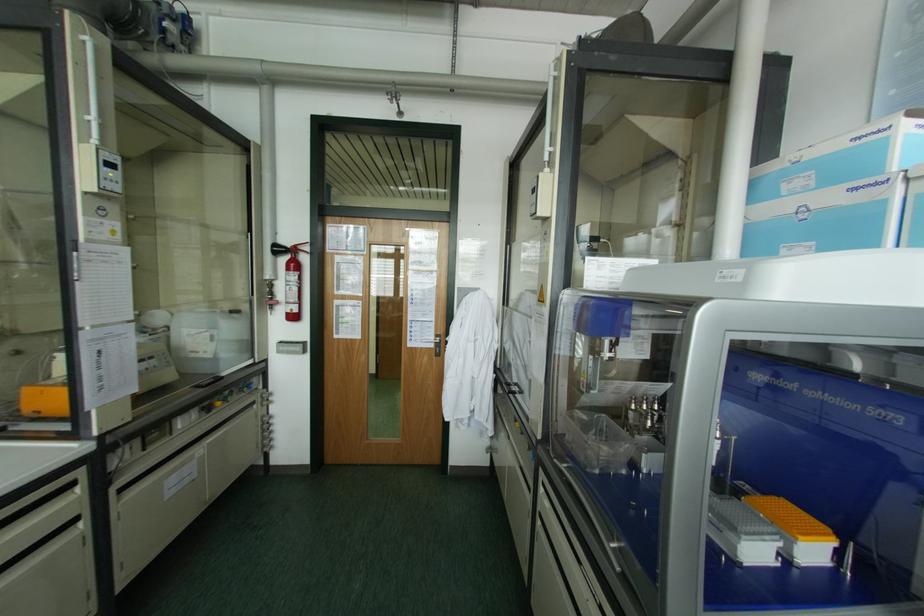
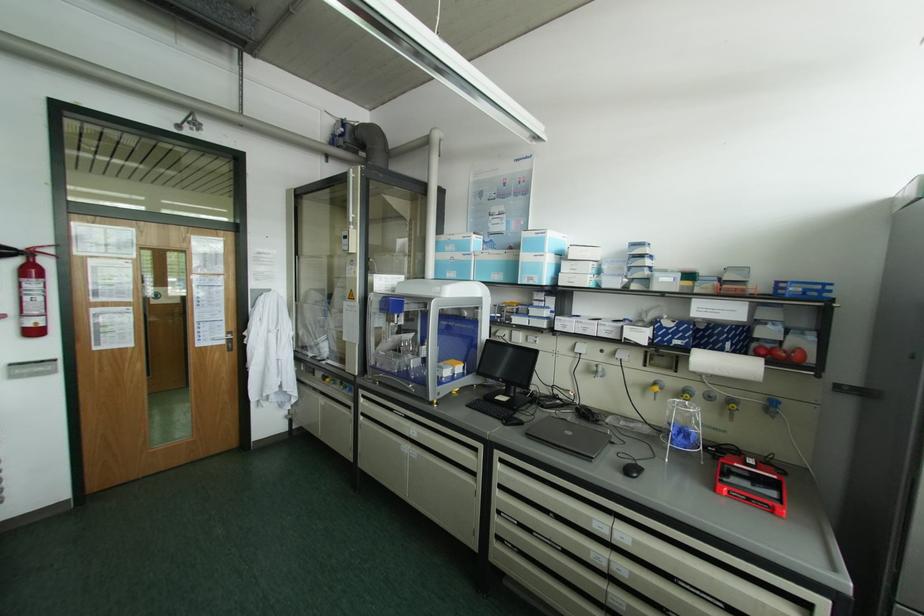
Where in the second image is the point corresponding to [431,345] from the first image?

(224, 342)